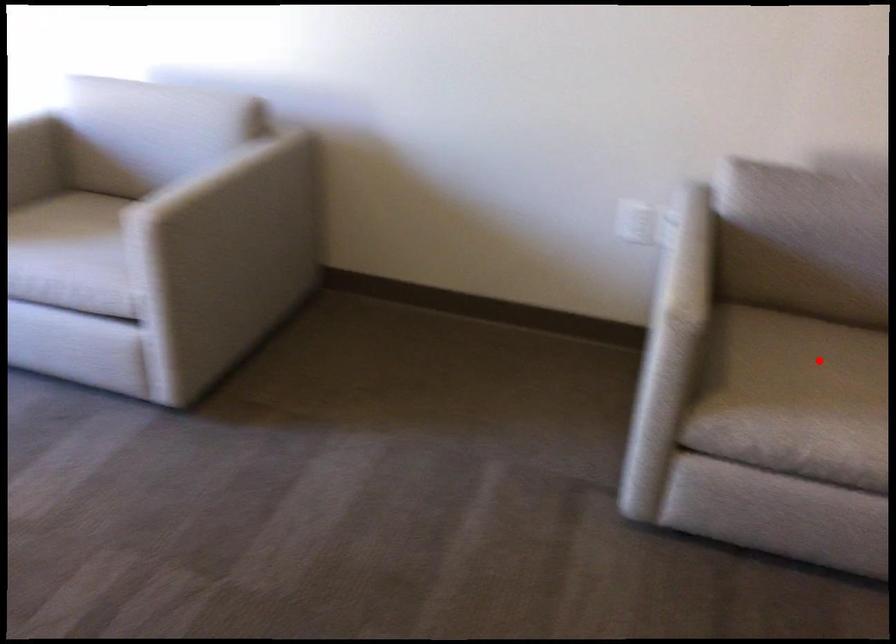
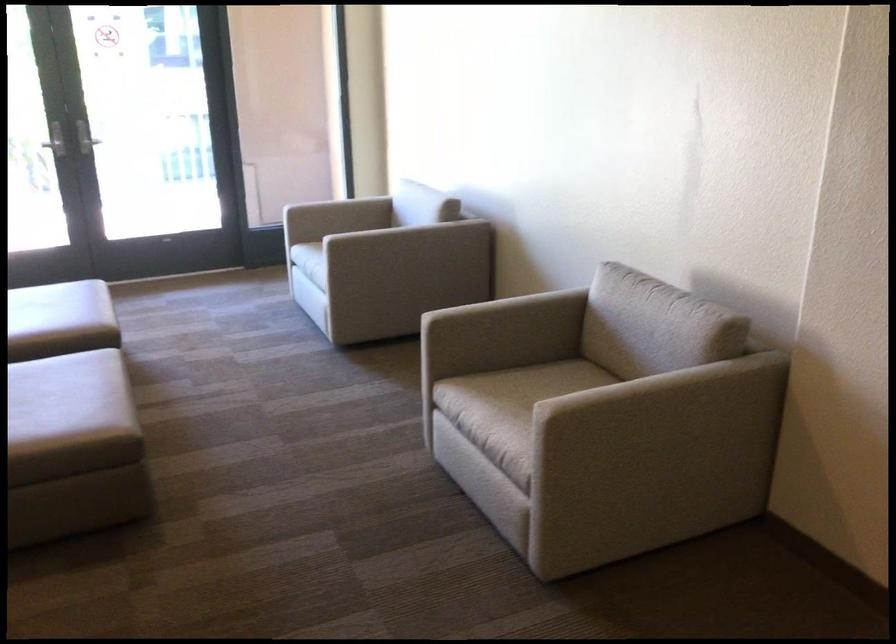
Question: I am providing you with two images of the same scene from different viewpoints. A red point is marked on the first image. Is the red point's position out of view in image 2?

Choices:
 (A) Yes
 (B) No

Answer: (A)